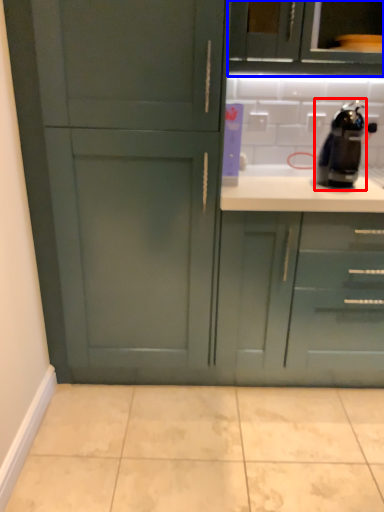
Question: Among these objects, which one is farthest to the camera, coffee machine (highlighted by a red box) or cabinetry (highlighted by a blue box)?

Choices:
 (A) coffee machine
 (B) cabinetry

Answer: (B)